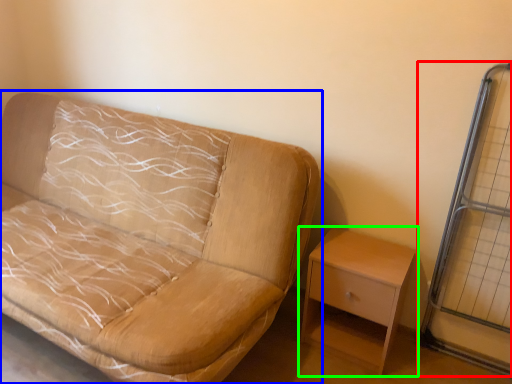
Question: Considering the real-world distances, which object is closest to glass door (highlighted by a red box)? studio couch (highlighted by a blue box) or nightstand (highlighted by a green box).

Choices:
 (A) studio couch
 (B) nightstand

Answer: (B)